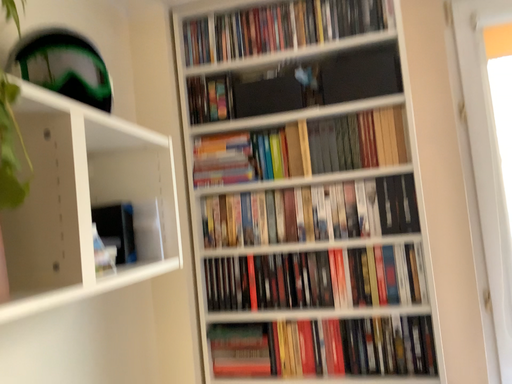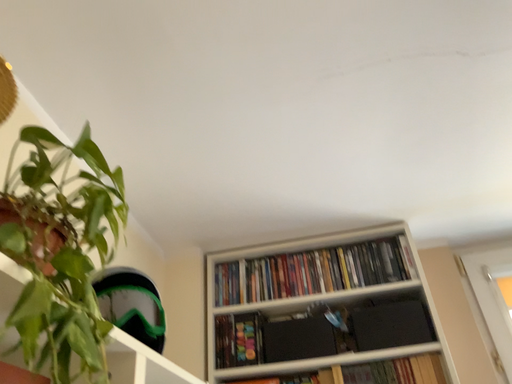
Question: Which way did the camera rotate in the video?

Choices:
 (A) rotated downward
 (B) rotated upward

Answer: (B)